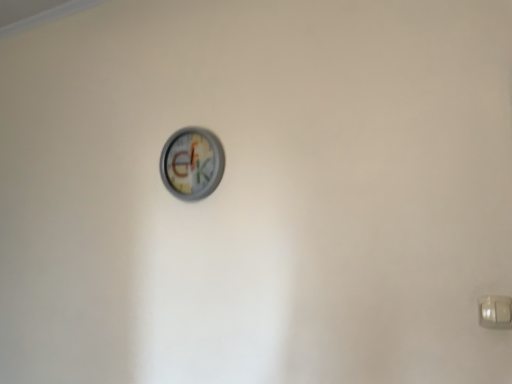
Question: Based on their sizes in the image, would you say metallic gray clock at center is bigger or smaller than white plastic door handle at lower right?

Choices:
 (A) small
 (B) big

Answer: (B)

Question: Considering the positions of point (204, 173) and point (503, 314), is point (204, 173) closer or farther from the camera than point (503, 314)?

Choices:
 (A) farther
 (B) closer

Answer: (A)

Question: Is metallic gray clock at center in front of or behind white plastic door handle at lower right in the image?

Choices:
 (A) behind
 (B) front

Answer: (A)

Question: Considering the positions of white plastic door handle at lower right and metallic gray clock at center in the image, is white plastic door handle at lower right bigger or smaller than metallic gray clock at center?

Choices:
 (A) small
 (B) big

Answer: (A)

Question: From a real-world perspective, is white plastic door handle at lower right above or below metallic gray clock at center?

Choices:
 (A) below
 (B) above

Answer: (A)

Question: Is white plastic door handle at lower right in front of or behind metallic gray clock at center in the image?

Choices:
 (A) front
 (B) behind

Answer: (A)

Question: Looking at their shapes, would you say white plastic door handle at lower right is wider or thinner than metallic gray clock at center?

Choices:
 (A) thin
 (B) wide

Answer: (A)